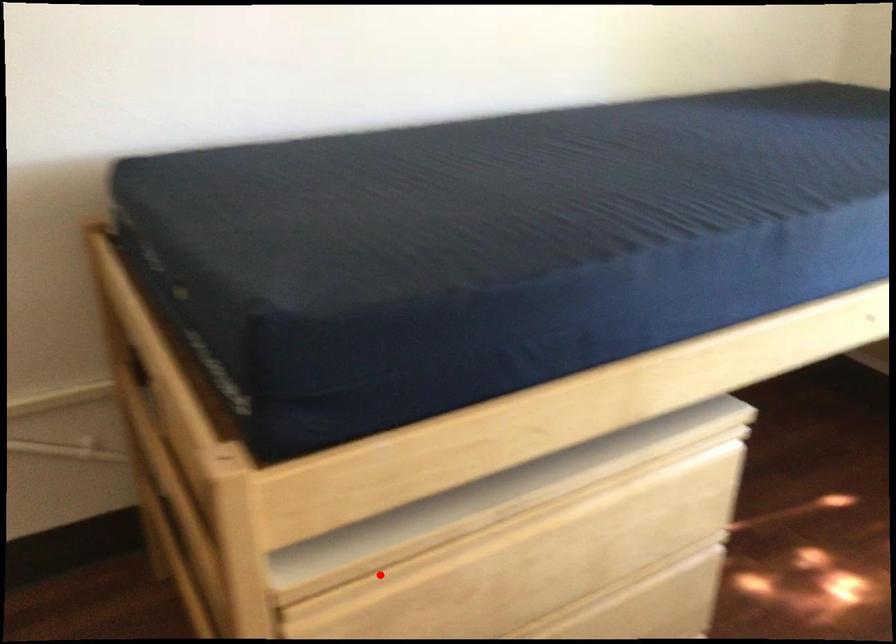
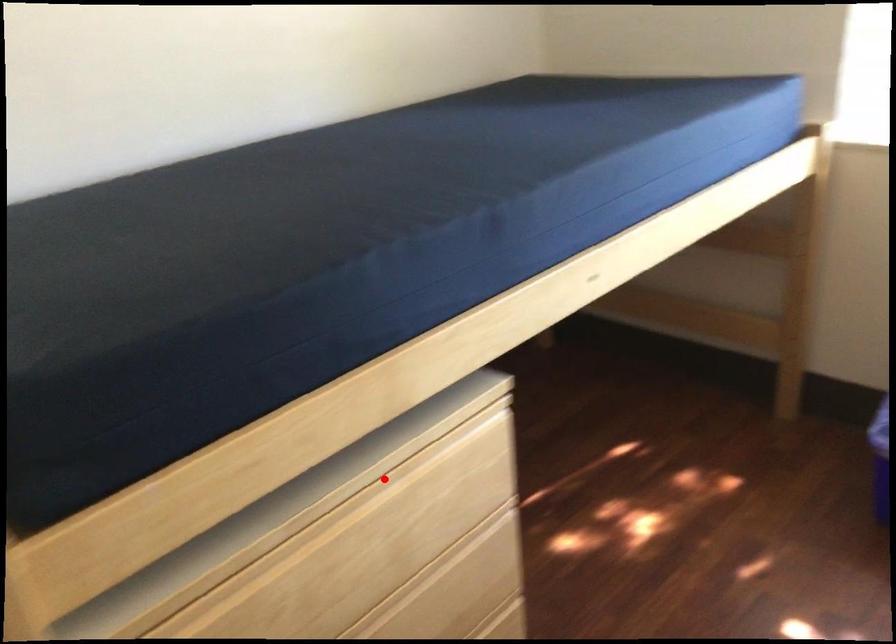
Based on the photo, I am providing you with two images of the same scene from different viewpoints. A red point is marked on the first image and another point is marked on the second image. Is the marked point in image1 the same physical position as the marked point in image2?

No